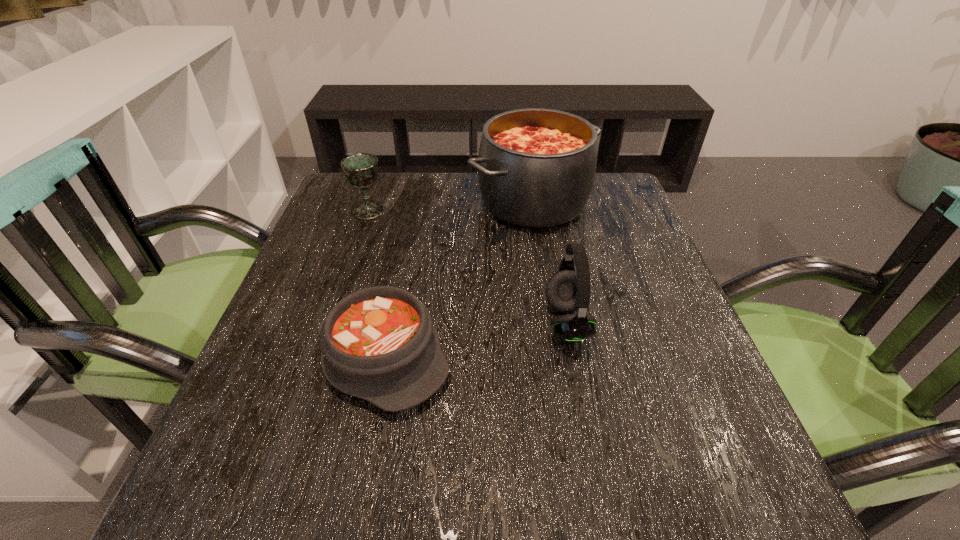
This screenshot has width=960, height=540. Find the location of `free point between the headset and the left casserole`. free point between the headset and the left casserole is located at coordinates tap(475, 339).

Image resolution: width=960 pixels, height=540 pixels. What are the coordinates of `free space between the shortest object and the second tallest object` in the screenshot? It's located at (475, 339).

You are a GUI agent. You are given a task and a screenshot of the screen. Output one action in this format:
    pyautogui.click(x=<x>, y=<y>)
    Task: Click on the empty space that is in between the right casserole and the chalice
    
    Given the screenshot: What is the action you would take?
    pyautogui.click(x=451, y=206)

I want to click on blank region between the headset and the taller casserole, so click(x=550, y=262).

Find the location of `vacant space that's between the headset and the right casserole`. vacant space that's between the headset and the right casserole is located at coordinates (550, 262).

The image size is (960, 540). I want to click on unoccupied position between the right casserole and the left casserole, so (458, 279).

Identify the location of free space between the headset and the shortest object. (475, 339).

Where is `object that ranks as the third closest to the second tallest object`? object that ranks as the third closest to the second tallest object is located at coordinates (361, 170).

At what (x,y) coordinates should I click in order to perform the action: click on object identified as the second closest to the taller casserole. Please return your answer as a coordinate pair (x, y). The width and height of the screenshot is (960, 540). Looking at the image, I should click on (361, 170).